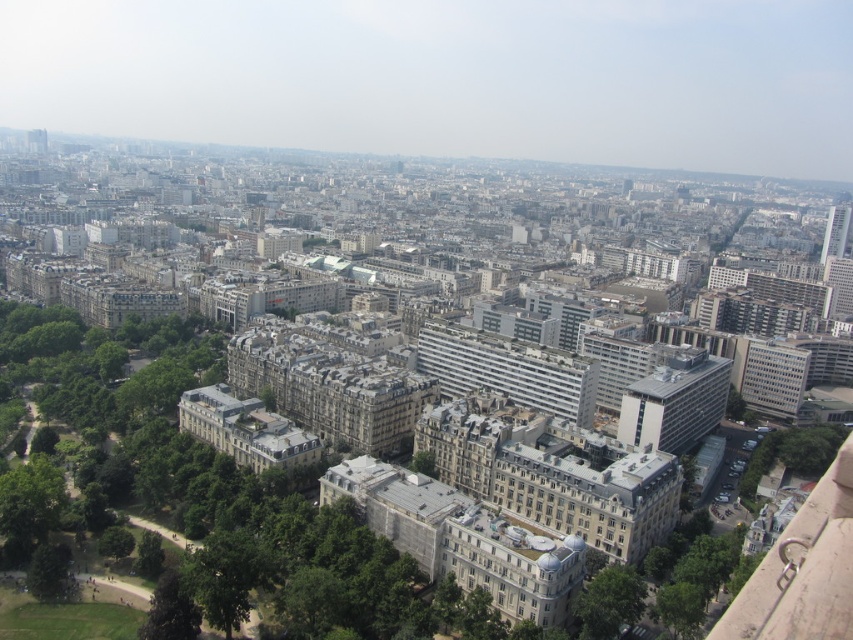
Question: Which of the following is the closest to the observer?

Choices:
 (A) [x=581, y=630]
 (B) [x=155, y=616]

Answer: (B)

Question: Among these points, which one is nearest to the camera?

Choices:
 (A) (160, 611)
 (B) (578, 636)

Answer: (A)

Question: Is green leafy tree at lower right smaller than green leafy tree at lower left?

Choices:
 (A) yes
 (B) no

Answer: (B)

Question: Can you confirm if green leafy tree at lower right is positioned below green leafy tree at lower left?

Choices:
 (A) no
 (B) yes

Answer: (B)

Question: Which object is closer to the camera taking this photo?

Choices:
 (A) green leafy tree at lower right
 (B) green leafy tree at lower left

Answer: (B)

Question: Where is green leafy tree at lower right located in relation to green leafy tree at lower left in the image?

Choices:
 (A) above
 (B) below

Answer: (B)